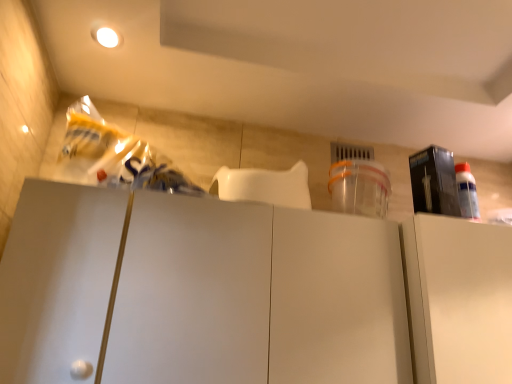
Question: From the image's perspective, relative to white matte cabinet at right, which is the second cabinetry from left to right, is matte black box at upper right above or below?

Choices:
 (A) below
 (B) above

Answer: (B)

Question: Does point (419, 165) appear closer or farther from the camera than point (458, 324)?

Choices:
 (A) farther
 (B) closer

Answer: (A)

Question: Which object is the closest to the matte black box at upper right?

Choices:
 (A) white matte cabinet at center, the 2th cabinetry positioned from the right
 (B) white matte cabinet at right, which ranks as the 1th cabinetry in right-to-left order

Answer: (B)

Question: Based on their relative distances, which object is farther from the white matte cabinet at center, the 2th cabinetry positioned from the right?

Choices:
 (A) matte black box at upper right
 (B) white matte cabinet at right, which ranks as the 1th cabinetry in right-to-left order

Answer: (A)